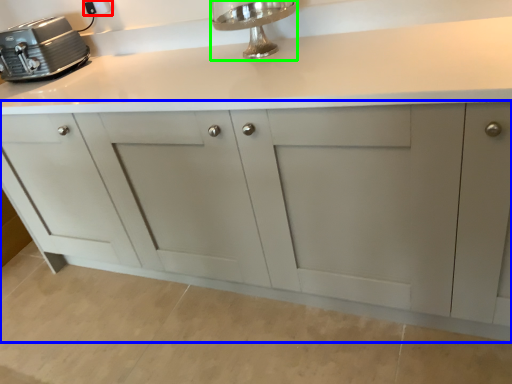
Question: Based on their relative distances, which object is nearer to electric outlet (highlighted by a red box)? Choose from cabinetry (highlighted by a blue box) and faucet (highlighted by a green box).

Choices:
 (A) cabinetry
 (B) faucet

Answer: (B)